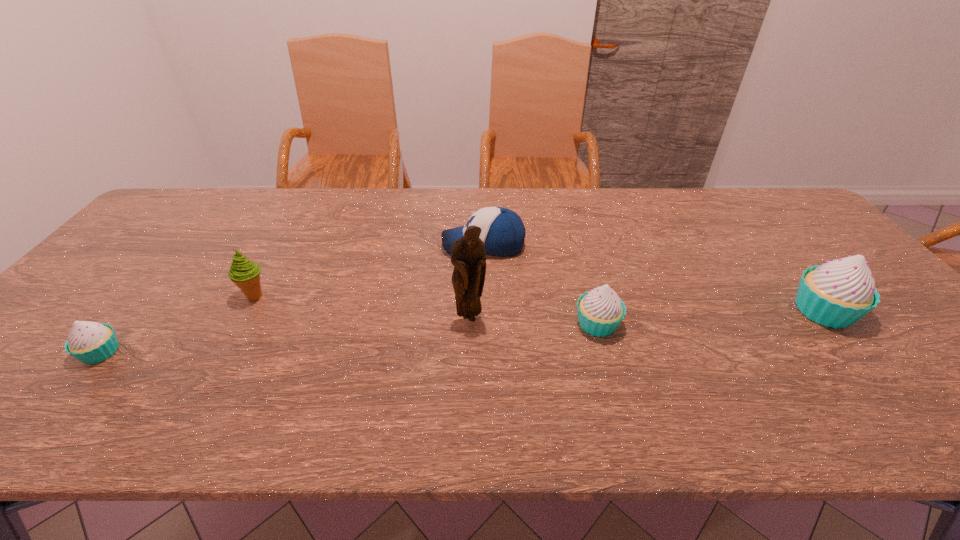
Locate which cupcake ranks second in proximity to the fifth object from right to left. Please provide its 2D coordinates. Your answer should be formatted as a tuple, i.e. [(x, y)], where the tuple contains the x and y coordinates of a point satisfying the conditions above.

[(600, 311)]

Identify which cupcake is located as the second nearest to the second object from left to right. Please provide its 2D coordinates. Your answer should be formatted as a tuple, i.e. [(x, y)], where the tuple contains the x and y coordinates of a point satisfying the conditions above.

[(600, 311)]

Where is `free space that satisfies the following two spatial constraints: 1. on the back side of the second shortest cupcake; 2. on the left side of the rightmost cupcake`? Image resolution: width=960 pixels, height=540 pixels. free space that satisfies the following two spatial constraints: 1. on the back side of the second shortest cupcake; 2. on the left side of the rightmost cupcake is located at coordinates (594, 311).